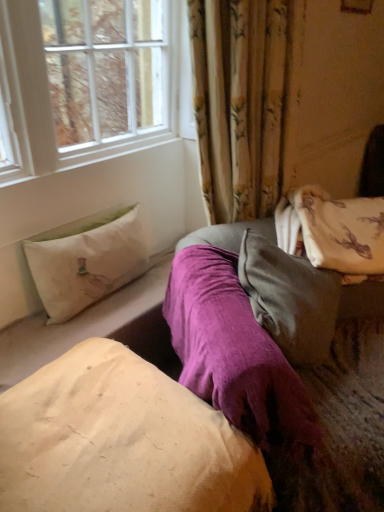
You are a GUI agent. You are given a task and a screenshot of the screen. Output one action in this format:
    pyautogui.click(x=<x>, y=<y>)
    Task: Click on the velvety gray pillow at center, arranged as the 2th pillow when viewed from the top
    This screenshot has width=384, height=512.
    Given the screenshot: What is the action you would take?
    pyautogui.click(x=290, y=298)

The width and height of the screenshot is (384, 512). Describe the element at coordinates (290, 298) in the screenshot. I see `velvety gray pillow at center, marked as the 2th pillow in a bottom-to-top arrangement` at that location.

Locate an element on the screen. Image resolution: width=384 pixels, height=512 pixels. velvety gray pillow at center, arranged as the 2th pillow when viewed from the top is located at coordinates (290, 298).

From the image's perspective, which is below, velvety gray pillow at center, arranged as the 2th pillow when viewed from the top, or beige cotton pillow at center, placed as the 1th pillow when sorted from bottom to top?

beige cotton pillow at center, placed as the 1th pillow when sorted from bottom to top.

Does point (283, 259) appear closer or farther from the camera than point (32, 415)?

Point (283, 259) is farther from the camera than point (32, 415).

Considering the sizes of objects velvety gray pillow at center, marked as the 2th pillow in a bottom-to-top arrangement, and beige cotton pillow at center, placed as the 1th pillow when sorted from bottom to top, in the image provided, who is smaller, velvety gray pillow at center, marked as the 2th pillow in a bottom-to-top arrangement, or beige cotton pillow at center, placed as the 1th pillow when sorted from bottom to top,?

Smaller between the two is velvety gray pillow at center, marked as the 2th pillow in a bottom-to-top arrangement.

Considering the sizes of objects beige cotton pillow at center, which is the 3th pillow in top-to-bottom order, and white fabric pillow at left, placed as the 3th pillow when sorted from bottom to top, in the image provided, who is thinner, beige cotton pillow at center, which is the 3th pillow in top-to-bottom order, or white fabric pillow at left, placed as the 3th pillow when sorted from bottom to top,?

With smaller width is white fabric pillow at left, placed as the 3th pillow when sorted from bottom to top.

Is white fabric pillow at left, which appears as the 1th pillow when viewed from the top, inside beige cotton pillow at center, placed as the 1th pillow when sorted from bottom to top?

Actually, white fabric pillow at left, which appears as the 1th pillow when viewed from the top, is outside beige cotton pillow at center, placed as the 1th pillow when sorted from bottom to top.

Considering the relative sizes of beige cotton pillow at center, placed as the 1th pillow when sorted from bottom to top, and white fabric pillow at left, which appears as the 1th pillow when viewed from the top, in the image provided, is beige cotton pillow at center, placed as the 1th pillow when sorted from bottom to top, shorter than white fabric pillow at left, which appears as the 1th pillow when viewed from the top,?

No, beige cotton pillow at center, placed as the 1th pillow when sorted from bottom to top, is not shorter than white fabric pillow at left, which appears as the 1th pillow when viewed from the top.

Is beige cotton pillow at center, placed as the 1th pillow when sorted from bottom to top, facing towards white fabric pillow at left, placed as the 3th pillow when sorted from bottom to top?

No, beige cotton pillow at center, placed as the 1th pillow when sorted from bottom to top, is not turned towards white fabric pillow at left, placed as the 3th pillow when sorted from bottom to top.

Looking at this image, is beige cotton pillow at center, placed as the 1th pillow when sorted from bottom to top, wider or thinner than velvety gray pillow at center, marked as the 2th pillow in a bottom-to-top arrangement?

beige cotton pillow at center, placed as the 1th pillow when sorted from bottom to top, is wider than velvety gray pillow at center, marked as the 2th pillow in a bottom-to-top arrangement.

Does beige cotton pillow at center, placed as the 1th pillow when sorted from bottom to top, have a smaller size compared to velvety gray pillow at center, arranged as the 2th pillow when viewed from the top?

No.

Based on their positions, is beige cotton pillow at center, placed as the 1th pillow when sorted from bottom to top, located to the left or right of velvety gray pillow at center, arranged as the 2th pillow when viewed from the top?

Clearly, beige cotton pillow at center, placed as the 1th pillow when sorted from bottom to top, is on the left of velvety gray pillow at center, arranged as the 2th pillow when viewed from the top, in the image.

From a real-world perspective, between beige cotton pillow at center, placed as the 1th pillow when sorted from bottom to top, and velvety gray pillow at center, arranged as the 2th pillow when viewed from the top, who is vertically lower?

beige cotton pillow at center, placed as the 1th pillow when sorted from bottom to top, from a real-world perspective.

Which object is thinner, velvety gray pillow at center, marked as the 2th pillow in a bottom-to-top arrangement, or white fabric pillow at left, which appears as the 1th pillow when viewed from the top?

Thinner between the two is white fabric pillow at left, which appears as the 1th pillow when viewed from the top.

From the image's perspective, which object appears higher, velvety gray pillow at center, arranged as the 2th pillow when viewed from the top, or white fabric pillow at left, which appears as the 1th pillow when viewed from the top?

white fabric pillow at left, which appears as the 1th pillow when viewed from the top, appears higher in the image.

From a real-world perspective, is velvety gray pillow at center, arranged as the 2th pillow when viewed from the top, located beneath white fabric pillow at left, which appears as the 1th pillow when viewed from the top?

No, from a real-world perspective, velvety gray pillow at center, arranged as the 2th pillow when viewed from the top, is not below white fabric pillow at left, which appears as the 1th pillow when viewed from the top.

Could you tell me if velvety gray pillow at center, marked as the 2th pillow in a bottom-to-top arrangement, is facing white fabric pillow at left, placed as the 3th pillow when sorted from bottom to top?

No, velvety gray pillow at center, marked as the 2th pillow in a bottom-to-top arrangement, does not turn towards white fabric pillow at left, placed as the 3th pillow when sorted from bottom to top.

Between point (51, 264) and point (261, 255), which one is positioned behind?

The point (51, 264) is behind.

From the picture: From the image's perspective, relative to velvety gray pillow at center, arranged as the 2th pillow when viewed from the top, is white fabric pillow at left, placed as the 3th pillow when sorted from bottom to top, above or below?

white fabric pillow at left, placed as the 3th pillow when sorted from bottom to top, is situated higher than velvety gray pillow at center, arranged as the 2th pillow when viewed from the top, in the image.

Does white fabric pillow at left, placed as the 3th pillow when sorted from bottom to top, lie behind velvety gray pillow at center, marked as the 2th pillow in a bottom-to-top arrangement?

Yes, white fabric pillow at left, placed as the 3th pillow when sorted from bottom to top, is further from the camera.

Can you confirm if white fabric pillow at left, placed as the 3th pillow when sorted from bottom to top, is wider than velvety gray pillow at center, arranged as the 2th pillow when viewed from the top?

Incorrect, the width of white fabric pillow at left, placed as the 3th pillow when sorted from bottom to top, does not surpass that of velvety gray pillow at center, arranged as the 2th pillow when viewed from the top.

Considering the relative sizes of white fabric pillow at left, placed as the 3th pillow when sorted from bottom to top, and beige cotton pillow at center, placed as the 1th pillow when sorted from bottom to top, in the image provided, is white fabric pillow at left, placed as the 3th pillow when sorted from bottom to top, wider than beige cotton pillow at center, placed as the 1th pillow when sorted from bottom to top,?

No.

Considering the sizes of objects white fabric pillow at left, placed as the 3th pillow when sorted from bottom to top, and beige cotton pillow at center, which is the 3th pillow in top-to-bottom order, in the image provided, who is bigger, white fabric pillow at left, placed as the 3th pillow when sorted from bottom to top, or beige cotton pillow at center, which is the 3th pillow in top-to-bottom order,?

beige cotton pillow at center, which is the 3th pillow in top-to-bottom order, is bigger.

In the scene shown: Is white fabric pillow at left, placed as the 3th pillow when sorted from bottom to top, closer to the viewer compared to beige cotton pillow at center, placed as the 1th pillow when sorted from bottom to top?

No, it is not.

Can you confirm if white fabric pillow at left, placed as the 3th pillow when sorted from bottom to top, is shorter than beige cotton pillow at center, which is the 3th pillow in top-to-bottom order?

Indeed, white fabric pillow at left, placed as the 3th pillow when sorted from bottom to top, has a lesser height compared to beige cotton pillow at center, which is the 3th pillow in top-to-bottom order.

Where is `pillow on the right of beige cotton pillow at center, which is the 3th pillow in top-to-bottom order`? Image resolution: width=384 pixels, height=512 pixels. pillow on the right of beige cotton pillow at center, which is the 3th pillow in top-to-bottom order is located at coordinates (290, 298).

This screenshot has height=512, width=384. I want to click on pillow that appears below the white fabric pillow at left, placed as the 3th pillow when sorted from bottom to top (from a real-world perspective), so click(121, 441).

Considering their positions, is velvety gray pillow at center, marked as the 2th pillow in a bottom-to-top arrangement, positioned further to beige cotton pillow at center, which is the 3th pillow in top-to-bottom order, than white fabric pillow at left, placed as the 3th pillow when sorted from bottom to top?

Based on the image, white fabric pillow at left, placed as the 3th pillow when sorted from bottom to top, appears to be further to beige cotton pillow at center, which is the 3th pillow in top-to-bottom order.

Based on their spatial positions, is velvety gray pillow at center, marked as the 2th pillow in a bottom-to-top arrangement, or beige cotton pillow at center, placed as the 1th pillow when sorted from bottom to top, further from white fabric pillow at left, placed as the 3th pillow when sorted from bottom to top?

velvety gray pillow at center, marked as the 2th pillow in a bottom-to-top arrangement, is positioned further to the anchor white fabric pillow at left, placed as the 3th pillow when sorted from bottom to top.

In the scene shown: From the image, which object appears to be nearer to velvety gray pillow at center, marked as the 2th pillow in a bottom-to-top arrangement, beige cotton pillow at center, placed as the 1th pillow when sorted from bottom to top, or white fabric pillow at left, placed as the 3th pillow when sorted from bottom to top?

beige cotton pillow at center, placed as the 1th pillow when sorted from bottom to top.

Looking at the image, which one is located further to velvety gray pillow at center, arranged as the 2th pillow when viewed from the top, white fabric pillow at left, which appears as the 1th pillow when viewed from the top, or beige cotton pillow at center, placed as the 1th pillow when sorted from bottom to top?

Among the two, white fabric pillow at left, which appears as the 1th pillow when viewed from the top, is located further to velvety gray pillow at center, arranged as the 2th pillow when viewed from the top.

Looking at the image, which one is located closer to white fabric pillow at left, placed as the 3th pillow when sorted from bottom to top, beige cotton pillow at center, placed as the 1th pillow when sorted from bottom to top, or velvety gray pillow at center, arranged as the 2th pillow when viewed from the top?

beige cotton pillow at center, placed as the 1th pillow when sorted from bottom to top.

Based on their spatial positions, is white fabric pillow at left, which appears as the 1th pillow when viewed from the top, or velvety gray pillow at center, arranged as the 2th pillow when viewed from the top, further from beige cotton pillow at center, which is the 3th pillow in top-to-bottom order?

white fabric pillow at left, which appears as the 1th pillow when viewed from the top, is positioned further to the anchor beige cotton pillow at center, which is the 3th pillow in top-to-bottom order.

Identify the location of pillow between white fabric pillow at left, placed as the 3th pillow when sorted from bottom to top, and velvety gray pillow at center, arranged as the 2th pillow when viewed from the top. (121, 441).